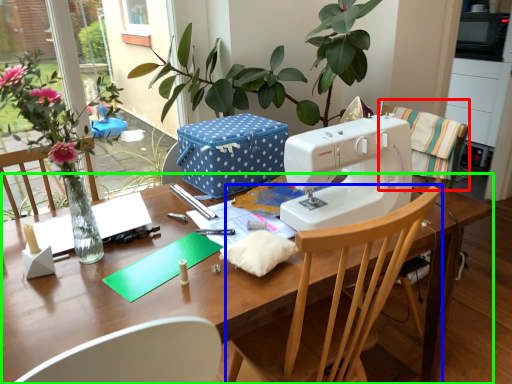
Question: Estimate the real-world distances between objects in this image. Which object is closer to chair (highlighted by a red box), chair (highlighted by a blue box) or table (highlighted by a green box)?

Choices:
 (A) chair
 (B) table

Answer: (A)